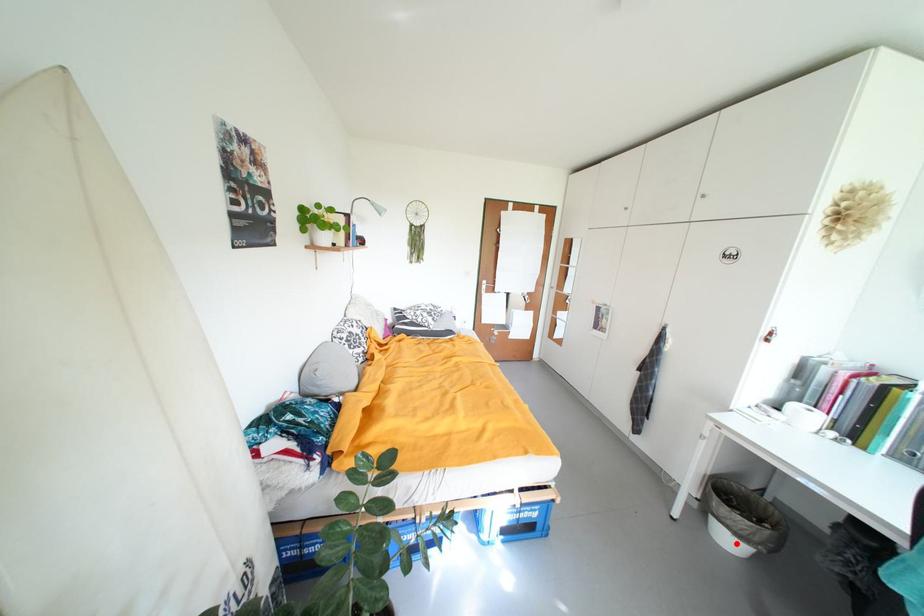
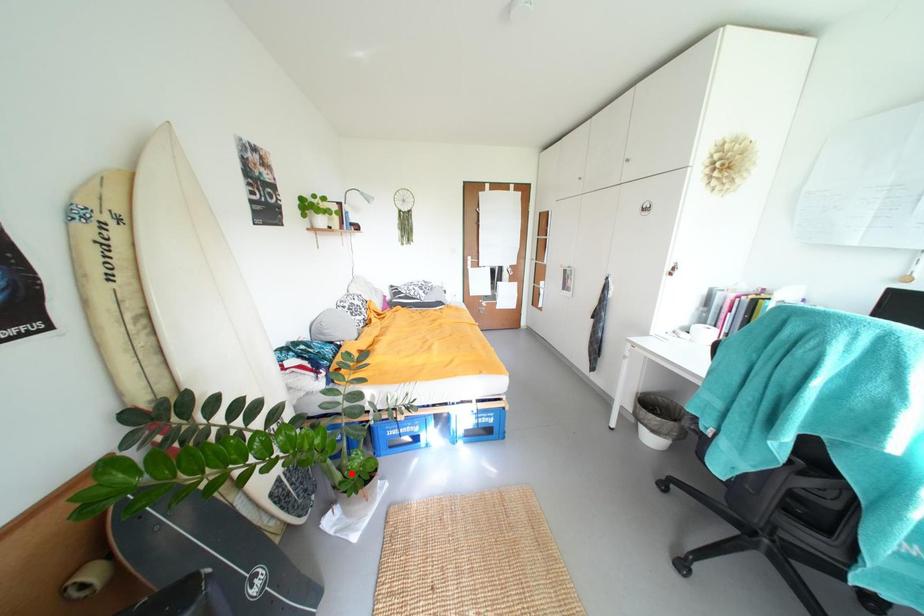
I am providing you with two images of the same scene from different viewpoints. A red point is marked on the first image and another point is marked on the second image. Do the highlighted points in image1 and image2 indicate the same real-world spot?

No